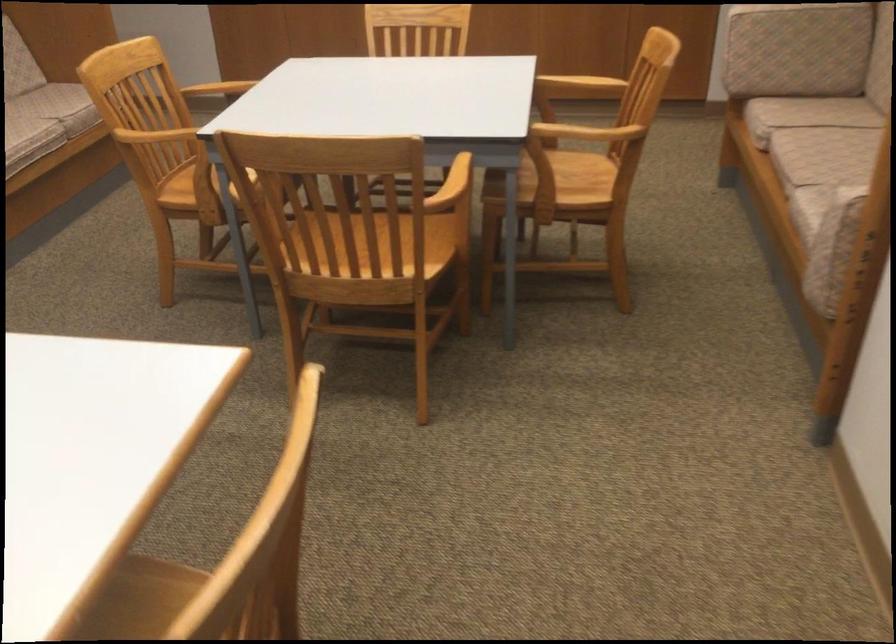
Find where to grasp the sofa armrest. Please return your answer as a coordinate pair (x, y).

(822, 190)